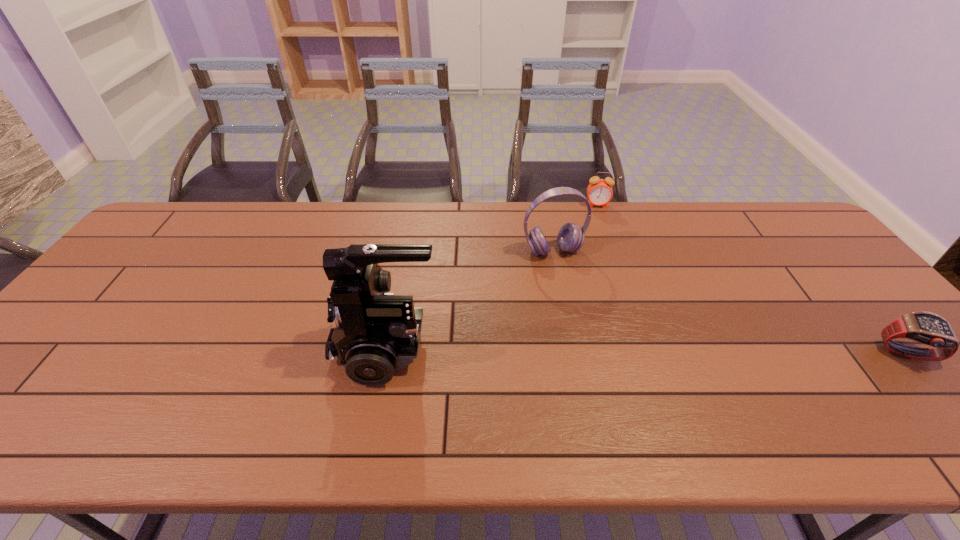
You are a GUI agent. You are given a task and a screenshot of the screen. Output one action in this format:
    pyautogui.click(x=<x>, y=<y>)
    Task: Click on the vacant space on the desktop that is between the tallest object and the rightmost object and is positioned on the headband and ear cups of the third object from right to left
    
    Given the screenshot: What is the action you would take?
    pyautogui.click(x=601, y=350)

This screenshot has height=540, width=960. Identify the location of free spot on the desktop that is between the camcorder and the rightmost object and is positioned on the face of the farthest object. (612, 350).